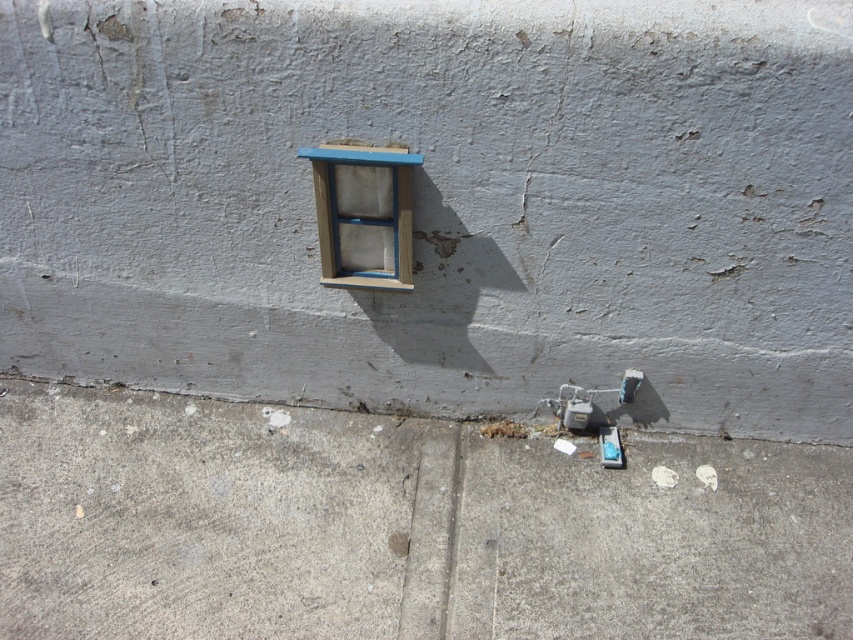
You are a delivery robot with a height of 24 inches. You need to navigate through the area shown in the image. The smooth concrete at lower center and the gray concrete sidewalk at lower center are in your path. What is the minimum height you should lower your delivery to ensure it can pass through the space between them?

The minimum height you should lower your delivery to ensure it can pass through the space between the smooth concrete at lower center and the gray concrete sidewalk at lower center is 19.00 inches, as that is the distance between them.

You are standing 2 meters away from the wall with the blue window frame. If you want to reach the point at coordinates point (457,273), can you do so without moving closer than your current distance?

The distance of point (457,273) from viewer is 1.86 meters, which is closer than your current 2 meters distance. To reach it, you would need to move 0.14 meters closer.